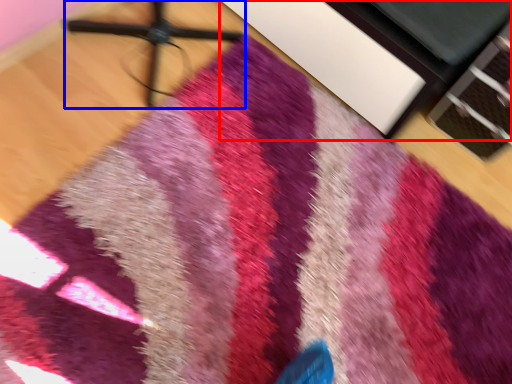
Question: Which of the following is the farthest to the observer, furniture (highlighted by a red box) or tripod (highlighted by a blue box)?

Choices:
 (A) furniture
 (B) tripod

Answer: (A)